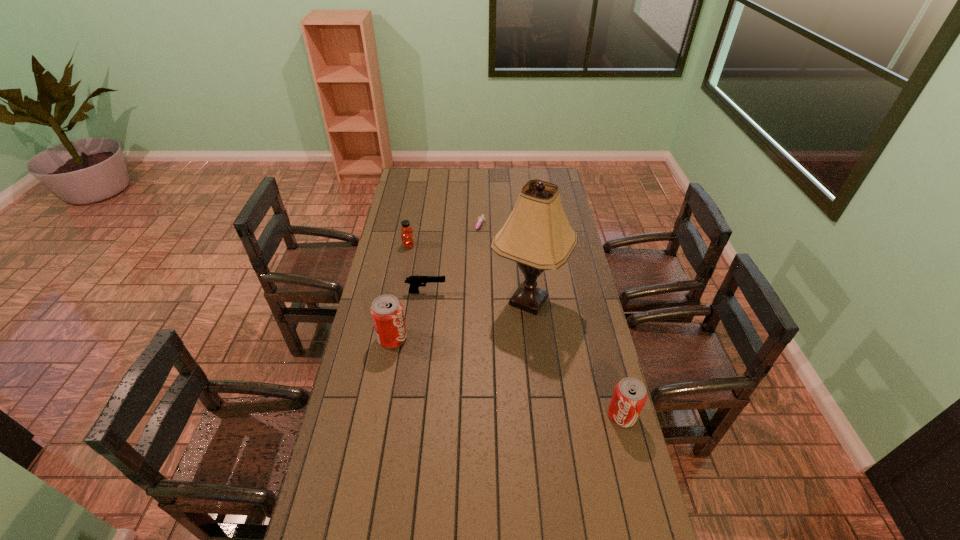
Locate an element on the screen. This screenshot has height=540, width=960. the second tallest object is located at coordinates (386, 311).

Locate an element on the screen. Image resolution: width=960 pixels, height=540 pixels. the farther soda can is located at coordinates (386, 311).

Find the location of a particular element. Image resolution: width=960 pixels, height=540 pixels. the third tallest object is located at coordinates (630, 395).

You are a GUI agent. You are given a task and a screenshot of the screen. Output one action in this format:
    pyautogui.click(x=<x>, y=<y>)
    Task: Click on the shorter soda can
    Image resolution: width=960 pixels, height=540 pixels.
    Given the screenshot: What is the action you would take?
    pyautogui.click(x=630, y=395)

Where is `honey`? This screenshot has width=960, height=540. honey is located at coordinates (407, 238).

At what (x,y) coordinates should I click in order to perform the action: click on the second farthest object. Please return your answer as a coordinate pair (x, y). This screenshot has width=960, height=540. Looking at the image, I should click on (407, 238).

Identify the location of the fifth object from left to right. Image resolution: width=960 pixels, height=540 pixels. (537, 235).

The image size is (960, 540). I want to click on the tallest object, so click(537, 235).

The height and width of the screenshot is (540, 960). In order to click on syringe in this screenshot , I will do `click(481, 219)`.

I want to click on the shortest object, so click(481, 219).